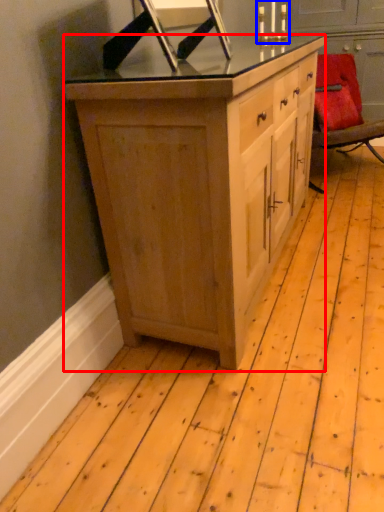
Question: Among these objects, which one is nearest to the camera, cabinetry (highlighted by a red box) or candle holder (highlighted by a blue box)?

Choices:
 (A) cabinetry
 (B) candle holder

Answer: (A)